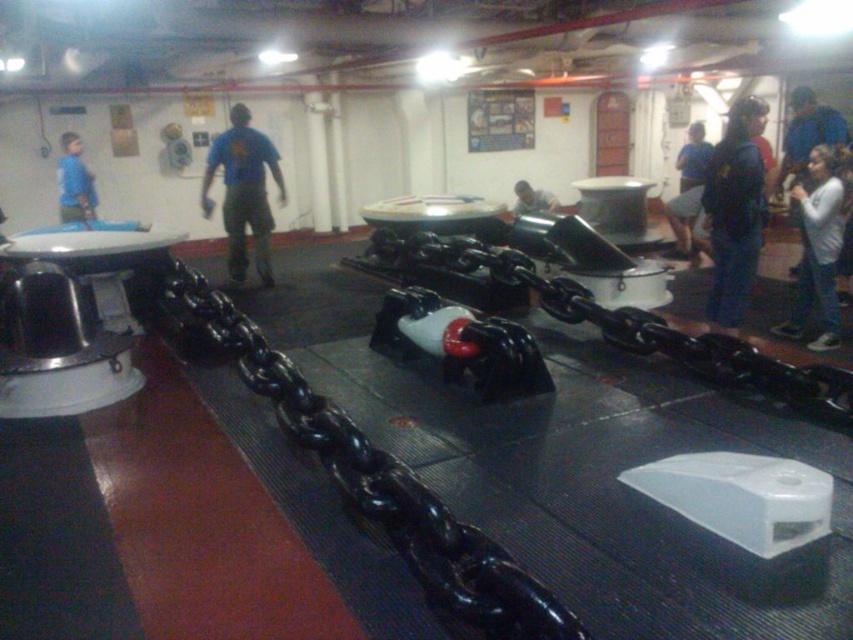
Which of these two, black glossy chain at center or blue t-shirt at center, stands shorter?

black glossy chain at center is shorter.

Is black glossy chain at center positioned behind blue t-shirt at center?

No, it is not.

Image resolution: width=853 pixels, height=640 pixels. What do you see at coordinates (366, 474) in the screenshot? I see `black glossy chain at center` at bounding box center [366, 474].

Locate an element on the screen. This screenshot has height=640, width=853. black glossy chain at center is located at coordinates (366, 474).

Looking at this image, which is more to the right, white cotton shirt at right or blue shirt at upper right?

blue shirt at upper right

Does white cotton shirt at right appear on the left side of blue shirt at upper right?

Indeed, white cotton shirt at right is positioned on the left side of blue shirt at upper right.

Does point (811, 221) lie behind point (682, 230)?

That is False.

You are a GUI agent. You are given a task and a screenshot of the screen. Output one action in this format:
    pyautogui.click(x=<x>, y=<y>)
    Task: Click on the white cotton shirt at right
    The width and height of the screenshot is (853, 640).
    Given the screenshot: What is the action you would take?
    pyautogui.click(x=817, y=248)

Where is `blue denim jeans at right`? blue denim jeans at right is located at coordinates (734, 211).

Is the position of blue denim jeans at right less distant than that of blue shirt at upper right?

Yes, it is.

Find the location of a particular element. Image resolution: width=853 pixels, height=640 pixels. blue denim jeans at right is located at coordinates (734, 211).

You are a GUI agent. You are given a task and a screenshot of the screen. Output one action in this format:
    pyautogui.click(x=<x>, y=<y>)
    Task: Click on the blue denim jeans at right
    The image size is (853, 640).
    Given the screenshot: What is the action you would take?
    pyautogui.click(x=734, y=211)